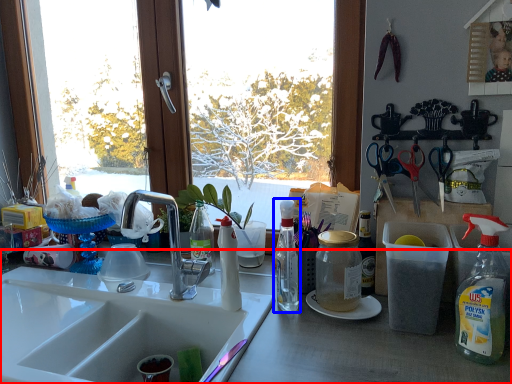
Question: Which of the following is the closest to the observer, desk (highlighted by a red box) or bottle (highlighted by a blue box)?

Choices:
 (A) desk
 (B) bottle

Answer: (A)